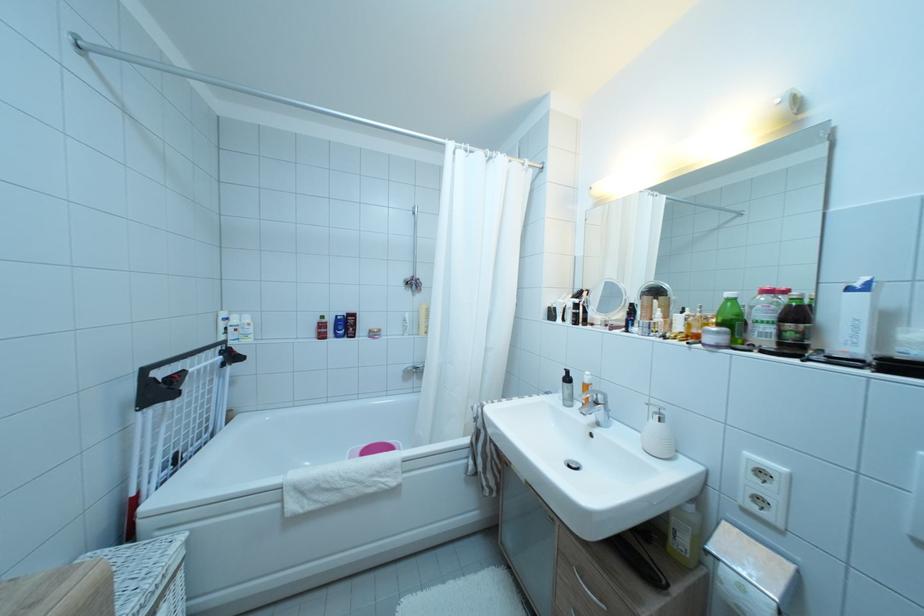
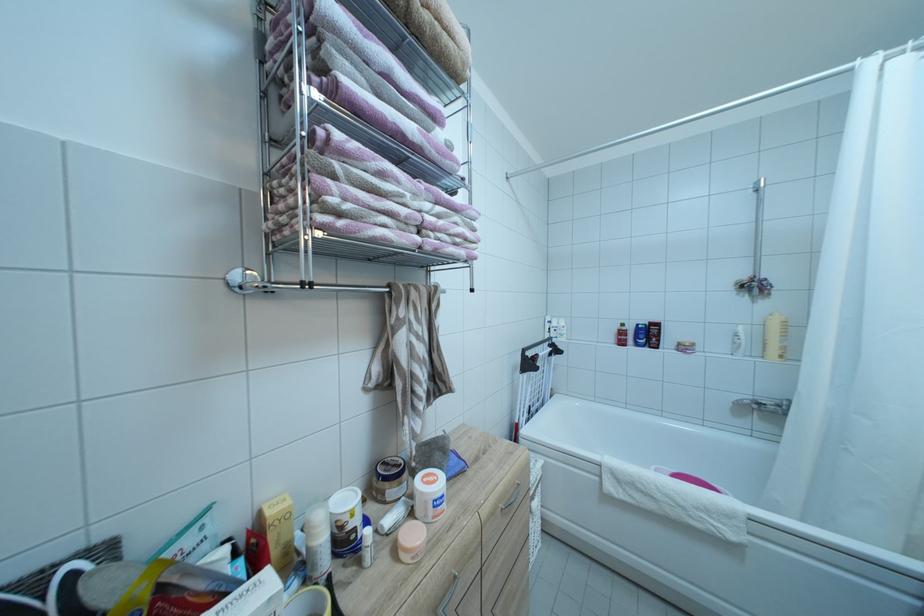
The point at (423,374) is marked in the first image. Where is the corresponding point in the second image?

(767, 410)